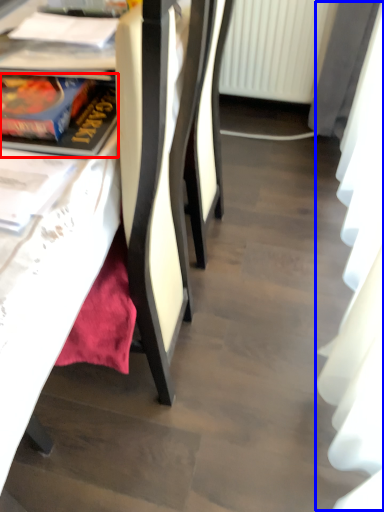
Question: Which object appears closest to the camera in this image, book (highlighted by a red box) or curtain (highlighted by a blue box)?

Choices:
 (A) book
 (B) curtain

Answer: (B)